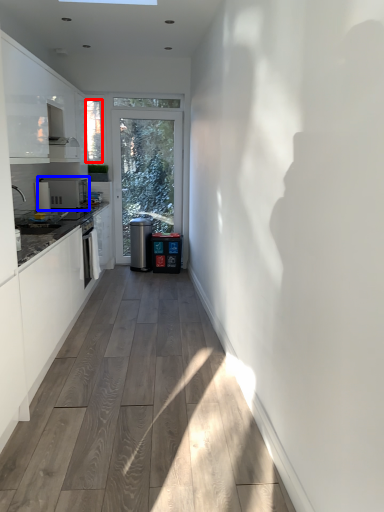
Question: Which object appears farthest to the camera in this image, window screen (highlighted by a red box) or appliance (highlighted by a blue box)?

Choices:
 (A) window screen
 (B) appliance

Answer: (A)